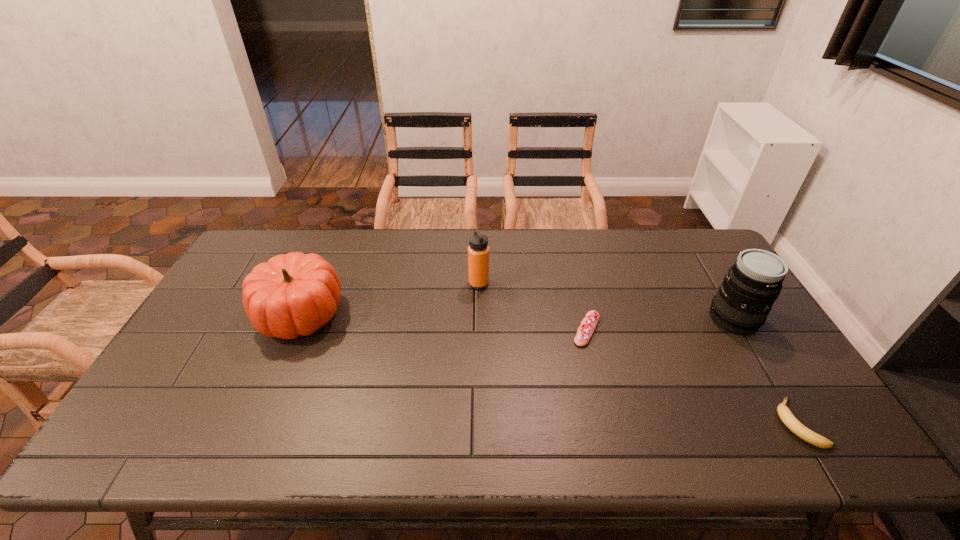
The height and width of the screenshot is (540, 960). In the image, there is a desktop. Find the location of `free space at the right edge`. free space at the right edge is located at coordinates click(x=778, y=376).

Where is `blank space at the far right corner`? blank space at the far right corner is located at coordinates coord(682,242).

Find the location of a particular element. This screenshot has width=960, height=540. vacant point located between the third object from right to left and the telephoto lens is located at coordinates (660, 324).

The width and height of the screenshot is (960, 540). Identify the location of vacant space that's between the eclair and the banana. (692, 376).

This screenshot has height=540, width=960. In order to click on free spot between the eclair and the telephoto lens in this screenshot , I will do coord(660,324).

At what (x,y) coordinates should I click in order to perform the action: click on free space that is in between the pumpkin and the telephoto lens. Please return your answer as a coordinate pair (x, y). The height and width of the screenshot is (540, 960). Looking at the image, I should click on (516, 316).

Find the location of a particular element. The height and width of the screenshot is (540, 960). vacant space in between the telephoto lens and the leftmost object is located at coordinates (516, 316).

This screenshot has height=540, width=960. I want to click on free space between the pumpkin and the nearest object, so click(x=548, y=368).

Where is `free point between the third object from left to right and the pumpkin`? This screenshot has height=540, width=960. free point between the third object from left to right and the pumpkin is located at coordinates tap(444, 321).

Find the location of a particular element. vacant space that is in between the telephoto lens and the leftmost object is located at coordinates (516, 316).